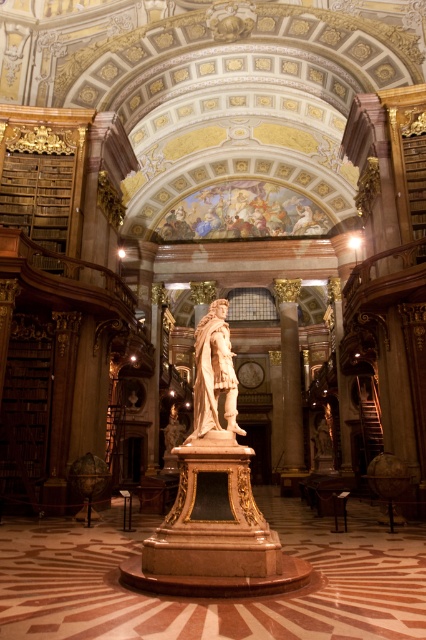
You are an art conservator examining the interior of this grand library. You need to move a protective covering from the polished bronze statue at center to the polished marble column at center. Based on their positions, which object should you approach first to ensure the covering doesn

The polished bronze statue at center is in front of the polished marble column at center, so you should first approach the polished bronze statue at center to place the covering on it before moving to the column.

You are an interior designer planning to place a new sofa in this grand library. The sofa must be positioned between the polished bronze statue at center and the polished marble column at center. Given that the statue is larger than the column, which object should the sofa be closer to for balance?

The sofa should be closer to the polished bronze statue at center because it is larger than the polished marble column at center, creating a balanced arrangement.